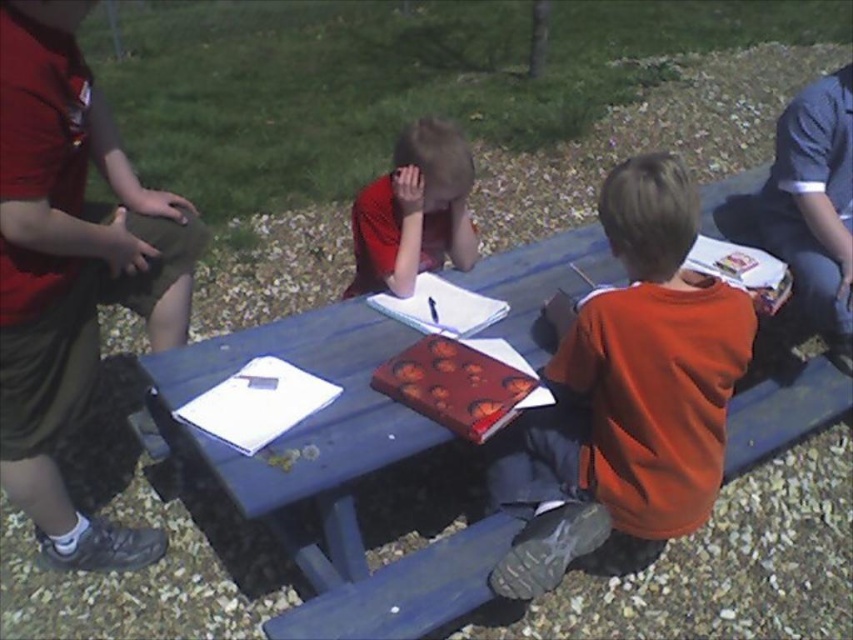
Question: Which is nearer to the matte red shirt at center?

Choices:
 (A) blue painted wood picnic table at center
 (B) dark blue jeans at right

Answer: (A)

Question: Estimate the real-world distances between objects in this image. Which object is farther from the orange matte shirt at center?

Choices:
 (A) blue painted wood picnic table at center
 (B) matte red shirt at center
 (C) dark blue jeans at right

Answer: (C)

Question: Is dark blue jeans at right positioned in front of matte red shirt at center?

Choices:
 (A) yes
 (B) no

Answer: (B)

Question: In this image, where is blue painted wood picnic table at center located relative to orange matte shirt at center?

Choices:
 (A) left
 (B) right

Answer: (A)

Question: Is blue painted wood picnic table at center smaller than orange matte shirt at center?

Choices:
 (A) no
 (B) yes

Answer: (A)

Question: Which of the following is the closest to the observer?

Choices:
 (A) (550, 561)
 (B) (390, 252)
 (C) (833, 128)

Answer: (A)